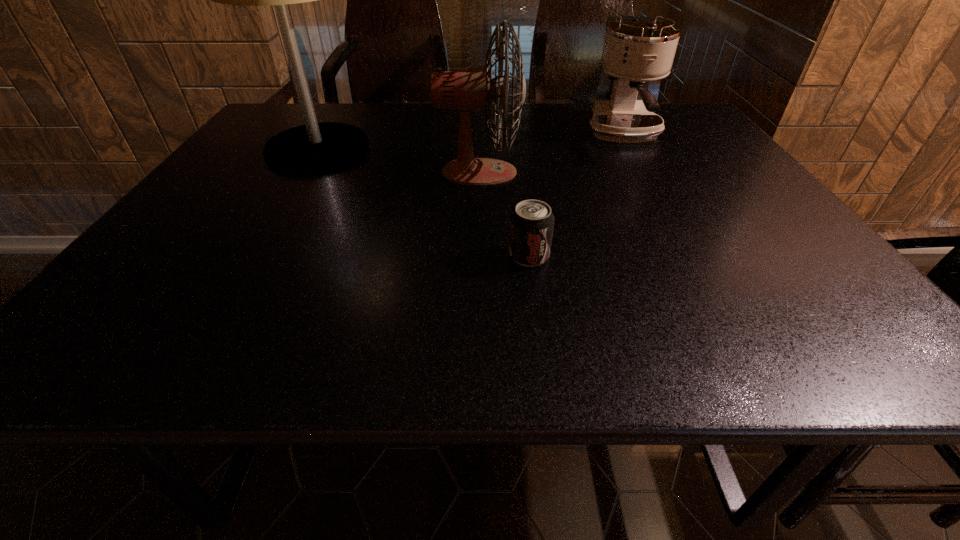
The width and height of the screenshot is (960, 540). What are the coordinates of `free spot between the coffee maker and the nearest object` in the screenshot? It's located at (577, 194).

The width and height of the screenshot is (960, 540). I want to click on vacant space that's between the soda can and the fan, so click(x=504, y=214).

Image resolution: width=960 pixels, height=540 pixels. I want to click on vacant space in between the fan and the table lamp, so click(x=398, y=161).

Locate an element on the screen. The height and width of the screenshot is (540, 960). vacant point located between the fan and the nearest object is located at coordinates (504, 214).

At what (x,y) coordinates should I click in order to perform the action: click on vacant point located between the rightmost object and the soda can. Please return your answer as a coordinate pair (x, y). Image resolution: width=960 pixels, height=540 pixels. Looking at the image, I should click on (577, 194).

Locate an element on the screen. vacant space that's between the table lamp and the fan is located at coordinates (398, 161).

Find the location of `vacant space in between the tallest object and the soda can`. vacant space in between the tallest object and the soda can is located at coordinates (423, 202).

The height and width of the screenshot is (540, 960). I want to click on unoccupied area between the leftmost object and the soda can, so click(423, 202).

Find the location of `unoccupied position between the fan and the soda can`. unoccupied position between the fan and the soda can is located at coordinates (504, 214).

I want to click on the third closest object to the coffee maker, so click(x=312, y=148).